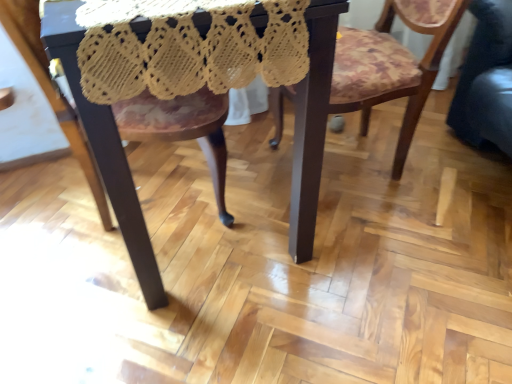
Identify the location of vacant space underneath wooden floral-patterned chair at center, the first chair viewed from the right (from a real-world perspective). click(359, 165).